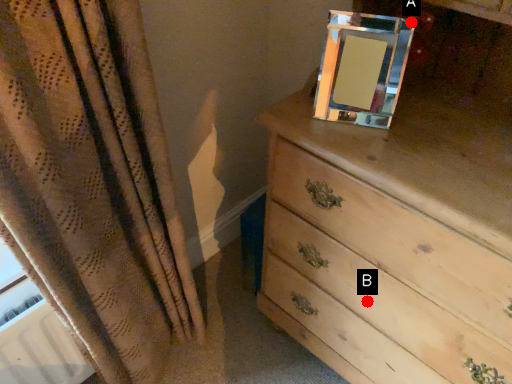
Question: Two points are circled on the image, labeled by A and B beside each circle. Which point is closer to the camera?

Choices:
 (A) A is closer
 (B) B is closer

Answer: (A)